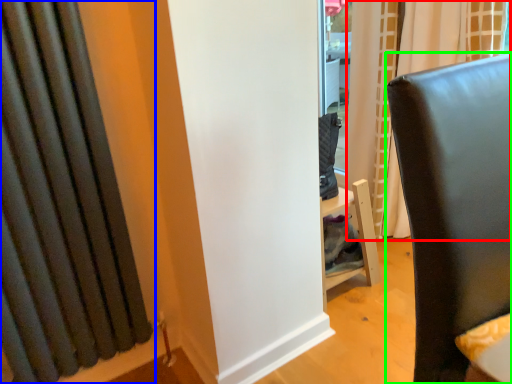
Question: Which object is positioned closest to curtain (highlighted by a red box)? Select from curtain (highlighted by a blue box) and furniture (highlighted by a green box).

Choices:
 (A) curtain
 (B) furniture

Answer: (B)